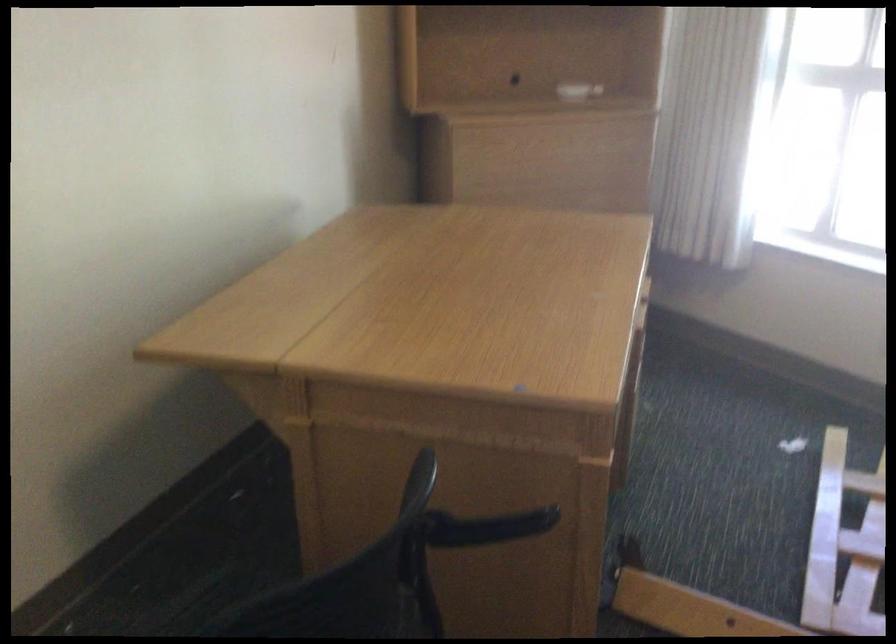
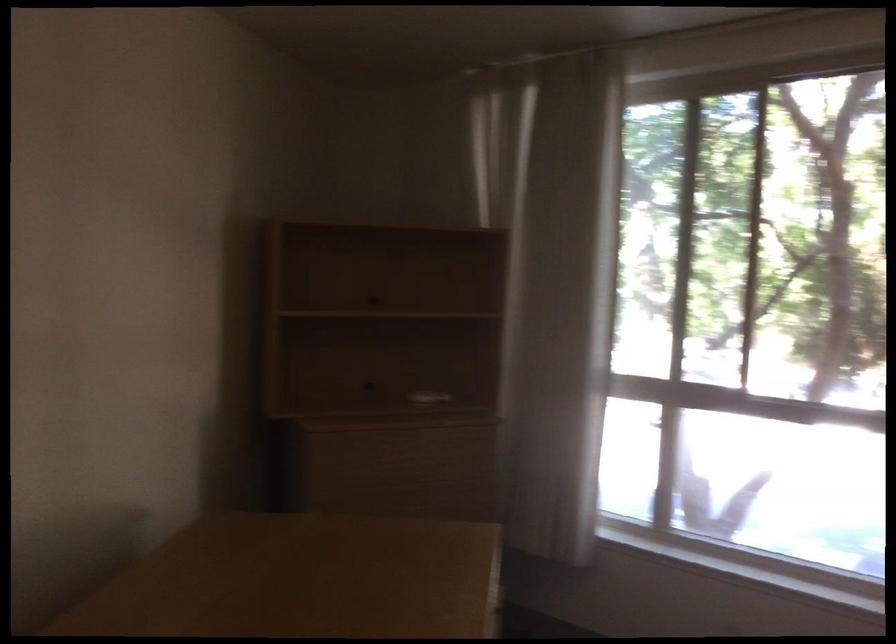
Question: Based on the continuous images, in which direction is the camera rotating? Reply with the corresponding letter.

Choices:
 (A) Left
 (B) Right
 (C) Up
 (D) Down

Answer: (C)